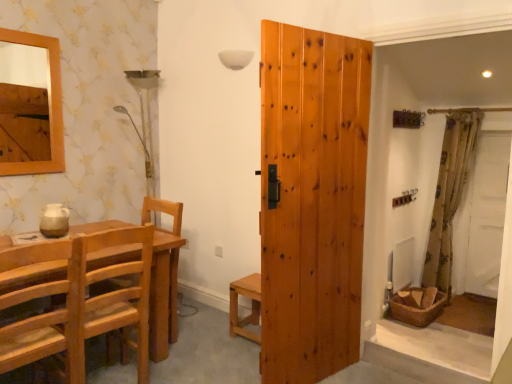
Describe the element at coordinates (163, 212) in the screenshot. I see `natural wood chair at left` at that location.

What do you see at coordinates (450, 194) in the screenshot?
I see `floral fabric curtain at right` at bounding box center [450, 194].

Describe the element at coordinates (47, 312) in the screenshot. I see `light brown wooden chair at lower left, the first chair when ordered from front to back` at that location.

Identify the location of light brown wooden chair at lower left, the first chair when ordered from front to back. The width and height of the screenshot is (512, 384). 47,312.

This screenshot has width=512, height=384. Find the location of `light brown wooden stool at center`. light brown wooden stool at center is located at coordinates (251, 306).

At what (x,y) coordinates should I click in order to perform the action: click on natural wood chair at left. Please return your answer as a coordinate pair (x, y). Looking at the image, I should click on (163, 212).

Would you say light brown wooden chair at left, the 1th chair when ordered from back to front, is part of natural wood chair at left's contents?

No, light brown wooden chair at left, the 1th chair when ordered from back to front, is not surrounded by natural wood chair at left.

From the image's perspective, is natural wood chair at left on light brown wooden chair at left, placed as the 2th chair when sorted from front to back?

Indeed, from the image's perspective, natural wood chair at left is shown above light brown wooden chair at left, placed as the 2th chair when sorted from front to back.

Which chair is the 1st one when counting from the front of the natural wood chair at left? Please provide its 2D coordinates.

[(120, 293)]

How different are the orientations of light brown wooden chair at lower left, the 2th chair in the back-to-front sequence, and floral fabric curtain at right in degrees?

The angle between the facing direction of light brown wooden chair at lower left, the 2th chair in the back-to-front sequence, and the facing direction of floral fabric curtain at right is 89.6 degrees.

Does light brown wooden chair at lower left, the first chair when ordered from front to back, turn towards floral fabric curtain at right?

No, light brown wooden chair at lower left, the first chair when ordered from front to back, is not oriented towards floral fabric curtain at right.

Is there a large distance between light brown wooden chair at lower left, the first chair when ordered from front to back, and floral fabric curtain at right?

light brown wooden chair at lower left, the first chair when ordered from front to back, is far away from floral fabric curtain at right.

Considering the positions of objects floral fabric curtain at right and light brown wooden chair at left, the 1th chair when ordered from back to front, in the image provided, who is more to the right, floral fabric curtain at right or light brown wooden chair at left, the 1th chair when ordered from back to front,?

Positioned to the right is floral fabric curtain at right.

Between floral fabric curtain at right and light brown wooden chair at left, the 1th chair when ordered from back to front, which one has larger size?

With larger size is floral fabric curtain at right.

Which is in front, point (440, 169) or point (139, 328)?

The point (139, 328) is more forward.

Between floral fabric curtain at right and light brown wooden chair at left, the 1th chair when ordered from back to front, which one has larger width?

Wider between the two is light brown wooden chair at left, the 1th chair when ordered from back to front.

From a real-world perspective, is light brown wooden stool at center physically below light brown wooden chair at lower left, the 2th chair in the back-to-front sequence?

Indeed, from a real-world perspective, light brown wooden stool at center is positioned beneath light brown wooden chair at lower left, the 2th chair in the back-to-front sequence.

Is light brown wooden stool at center to the left of light brown wooden chair at lower left, the 2th chair in the back-to-front sequence, from the viewer's perspective?

In fact, light brown wooden stool at center is to the right of light brown wooden chair at lower left, the 2th chair in the back-to-front sequence.

From the image's perspective, which one is positioned lower, light brown wooden stool at center or light brown wooden chair at lower left, the first chair when ordered from front to back?

From the image's view, light brown wooden stool at center is below.

Between light brown wooden stool at center and light brown wooden chair at lower left, the 2th chair in the back-to-front sequence, which one has more height?

Standing taller between the two is light brown wooden chair at lower left, the 2th chair in the back-to-front sequence.

Relative to white fabric screen door at right, is floral fabric curtain at right in front or behind?

Clearly, floral fabric curtain at right is in front of white fabric screen door at right.

Would you say floral fabric curtain at right is inside or outside white fabric screen door at right?

floral fabric curtain at right is not inside white fabric screen door at right, it's outside.

Does floral fabric curtain at right have a lesser width compared to white fabric screen door at right?

Incorrect, the width of floral fabric curtain at right is not less than that of white fabric screen door at right.

In order to click on screen door on the right of floral fabric curtain at right in this screenshot , I will do `click(487, 213)`.

Find the location of a particular element. The height and width of the screenshot is (384, 512). screen door on the right of the light brown wooden chair at lower left, the 2th chair in the back-to-front sequence is located at coordinates (487, 213).

Is white fabric screen door at right positioned before light brown wooden chair at lower left, the 2th chair in the back-to-front sequence?

No, white fabric screen door at right is further to the viewer.

Is the surface of white fabric screen door at right in direct contact with light brown wooden chair at lower left, the 2th chair in the back-to-front sequence?

No.

Considering the positions of objects natural wood chair at left and light brown wooden chair at lower left, the 2th chair in the back-to-front sequence, in the image provided, who is more to the right, natural wood chair at left or light brown wooden chair at lower left, the 2th chair in the back-to-front sequence,?

natural wood chair at left.

From a real-world perspective, who is located lower, natural wood chair at left or light brown wooden chair at lower left, the first chair when ordered from front to back?

natural wood chair at left is physically lower.

Is point (173, 205) farther from camera compared to point (78, 290)?

Yes, it is.

Between natural wood chair at left and light brown wooden chair at lower left, the first chair when ordered from front to back, which one is positioned behind?

natural wood chair at left is more distant.

Locate an element on the screen. This screenshot has height=384, width=512. armchair located above the light brown wooden chair at left, the 1th chair when ordered from back to front (from the image's perspective) is located at coordinates (163, 212).

The width and height of the screenshot is (512, 384). Identify the location of curtain located on the right of light brown wooden chair at lower left, the 2th chair in the back-to-front sequence. (450, 194).

Which object lies nearer to the anchor point white fabric screen door at right, light brown wooden stool at center or light brown wooden chair at left, placed as the 2th chair when sorted from front to back?

Based on the image, light brown wooden stool at center appears to be nearer to white fabric screen door at right.

When comparing their distances from light brown wooden chair at lower left, the 2th chair in the back-to-front sequence, does light brown wooden stool at center or floral fabric curtain at right seem further?

The object further to light brown wooden chair at lower left, the 2th chair in the back-to-front sequence, is floral fabric curtain at right.

Based on the photo, looking at the image, which one is located further to light brown wooden chair at left, placed as the 2th chair when sorted from front to back, floral fabric curtain at right or natural wood door at center?

Among the two, floral fabric curtain at right is located further to light brown wooden chair at left, placed as the 2th chair when sorted from front to back.

From the image, which object appears to be farther from light brown wooden chair at lower left, the first chair when ordered from front to back, natural wood chair at left or floral fabric curtain at right?

floral fabric curtain at right lies further to light brown wooden chair at lower left, the first chair when ordered from front to back, than the other object.

Looking at the image, which one is located closer to floral fabric curtain at right, natural wood chair at left or white fabric screen door at right?

white fabric screen door at right is positioned closer to the anchor floral fabric curtain at right.

Estimate the real-world distances between objects in this image. Which object is closer to natural wood chair at left, natural wood door at center or light brown wooden chair at lower left, the first chair when ordered from front to back?

light brown wooden chair at lower left, the first chair when ordered from front to back, lies closer to natural wood chair at left than the other object.

Considering their positions, is floral fabric curtain at right positioned closer to light brown wooden chair at lower left, the first chair when ordered from front to back, than natural wood chair at left?

natural wood chair at left is positioned closer to the anchor light brown wooden chair at lower left, the first chair when ordered from front to back.

When comparing their distances from light brown wooden chair at lower left, the 2th chair in the back-to-front sequence, does light brown wooden chair at left, placed as the 2th chair when sorted from front to back, or floral fabric curtain at right seem further?

floral fabric curtain at right.

What are the coordinates of `chair between light brown wooden chair at lower left, the first chair when ordered from front to back, and natural wood door at center` in the screenshot? It's located at (120, 293).

Identify the location of table between natural wood chair at left and natural wood door at center in the horizontal direction. (251, 306).

You are a GUI agent. You are given a task and a screenshot of the screen. Output one action in this format:
    pyautogui.click(x=<x>, y=<y>)
    Task: Click on the door between natural wood chair at left and floral fabric curtain at right from left to right
    
    Given the screenshot: What is the action you would take?
    pyautogui.click(x=312, y=200)

Locate an element on the screen. The image size is (512, 384). chair between light brown wooden chair at lower left, the 2th chair in the back-to-front sequence, and floral fabric curtain at right, in the horizontal direction is located at coordinates (120, 293).